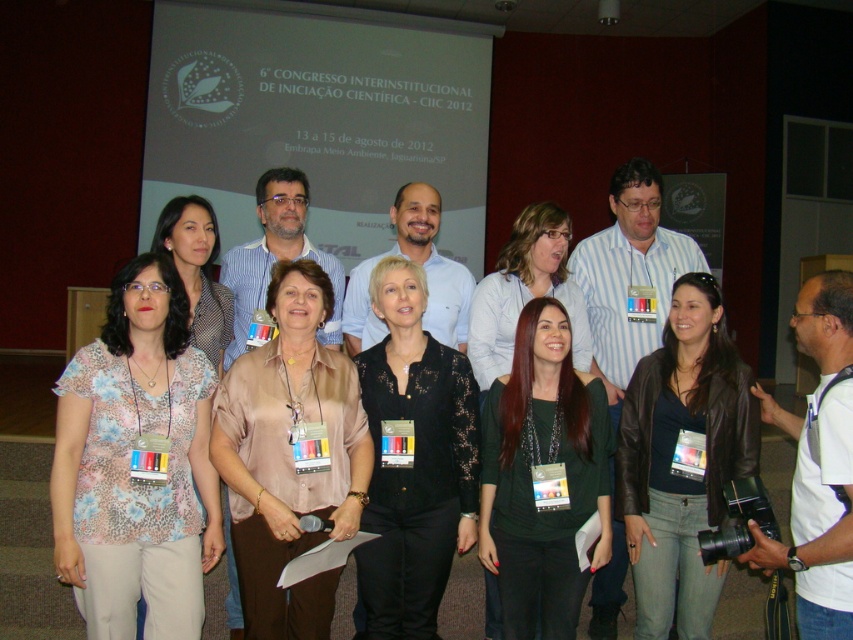
Question: Is dark green jersey at center to the right of white shirt at center from the viewer's perspective?

Choices:
 (A) no
 (B) yes

Answer: (A)

Question: Which object appears farthest from the camera in this image?

Choices:
 (A) floral print blouse at center
 (B) black lace blouse at center

Answer: (B)

Question: Based on their relative distances, which object is farther from the matte floral blouse at lower left?

Choices:
 (A) dark green jersey at center
 (B) matte pink blouse at center
 (C) floral print blouse at center
 (D) leather jacket at center

Answer: (D)

Question: Which object is farther from the camera taking this photo?

Choices:
 (A) black lace blouse at center
 (B) matte brown blouse at center

Answer: (B)

Question: Where is leather jacket at center located in relation to black lace blouse at center in the image?

Choices:
 (A) left
 (B) right

Answer: (B)

Question: Does black lace blouse at center have a greater width compared to matte brown blouse at center?

Choices:
 (A) no
 (B) yes

Answer: (A)